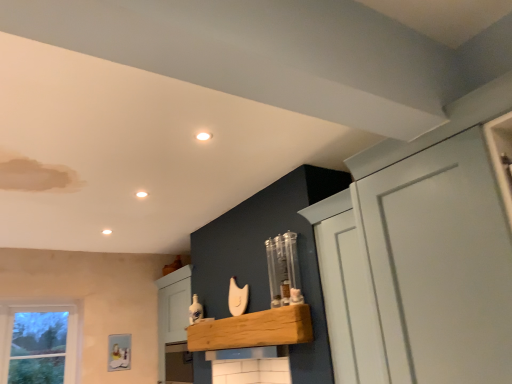
Where is `white matte cupboard at upper right`? The height and width of the screenshot is (384, 512). white matte cupboard at upper right is located at coordinates (419, 270).

What do you see at coordinates (419, 270) in the screenshot? I see `white matte cupboard at upper right` at bounding box center [419, 270].

Find the location of a particular element. natural wood shelf at center is located at coordinates (253, 330).

This screenshot has width=512, height=384. What do you see at coordinates (253, 330) in the screenshot?
I see `natural wood shelf at center` at bounding box center [253, 330].

The image size is (512, 384). Identify the location of white matte cupboard at upper right. (419, 270).

Does natural wood shelf at center appear on the right side of white matte cupboard at upper right?

No, natural wood shelf at center is not to the right of white matte cupboard at upper right.

Between natural wood shelf at center and white matte cupboard at upper right, which one is positioned behind?

Positioned behind is natural wood shelf at center.

Considering the positions of point (210, 349) and point (361, 354), is point (210, 349) closer or farther from the camera than point (361, 354)?

Point (210, 349).

From the image's perspective, is natural wood shelf at center located beneath white matte cupboard at upper right?

Indeed, from the image's perspective, natural wood shelf at center is shown beneath white matte cupboard at upper right.

From a real-world perspective, is natural wood shelf at center positioned above or below white matte cupboard at upper right?

From a real-world perspective, natural wood shelf at center is physically below white matte cupboard at upper right.

Considering the sizes of natural wood shelf at center and white matte cupboard at upper right in the image, is natural wood shelf at center wider or thinner than white matte cupboard at upper right?

natural wood shelf at center is thinner than white matte cupboard at upper right.

Is natural wood shelf at center taller or shorter than white matte cupboard at upper right?

Clearly, natural wood shelf at center is shorter compared to white matte cupboard at upper right.

Can you confirm if natural wood shelf at center is bigger than white matte cupboard at upper right?

Incorrect, natural wood shelf at center is not larger than white matte cupboard at upper right.

Could white matte cupboard at upper right be considered to be inside natural wood shelf at center?

No, natural wood shelf at center does not contain white matte cupboard at upper right.

Is natural wood shelf at center placed right next to white matte cupboard at upper right?

They are not placed beside each other.

Is natural wood shelf at center aimed at white matte cupboard at upper right?

No, natural wood shelf at center is not oriented towards white matte cupboard at upper right.

Can you tell me how much natural wood shelf at center and white matte cupboard at upper right differ in facing direction?

The angle between the facing direction of natural wood shelf at center and the facing direction of white matte cupboard at upper right is 1.42 degrees.

Measure the distance between natural wood shelf at center and white matte cupboard at upper right.

They are 39.09 inches apart.

You are a GUI agent. You are given a task and a screenshot of the screen. Output one action in this format:
    pyautogui.click(x=<x>, y=<y>)
    Task: Click on the cupboard lying in front of the natural wood shelf at center
    
    Given the screenshot: What is the action you would take?
    pyautogui.click(x=419, y=270)

Does white matte cupboard at upper right appear on the right side of natural wood shelf at center?

Yes, white matte cupboard at upper right is to the right of natural wood shelf at center.

In the image, is white matte cupboard at upper right positioned in front of or behind natural wood shelf at center?

white matte cupboard at upper right is positioned closer to the viewer than natural wood shelf at center.

Is point (485, 378) positioned before point (211, 331)?

Yes, point (485, 378) is in front of point (211, 331).

Consider the image. From the image's perspective, is white matte cupboard at upper right on top of natural wood shelf at center?

Indeed, from the image's perspective, white matte cupboard at upper right is shown above natural wood shelf at center.

From a real-world perspective, between white matte cupboard at upper right and natural wood shelf at center, who is vertically higher?

white matte cupboard at upper right, from a real-world perspective.

Looking at their sizes, would you say white matte cupboard at upper right is wider or thinner than natural wood shelf at center?

In the image, white matte cupboard at upper right appears to be wider than natural wood shelf at center.

Which of these two, white matte cupboard at upper right or natural wood shelf at center, stands shorter?

natural wood shelf at center is shorter.

Who is bigger, white matte cupboard at upper right or natural wood shelf at center?

white matte cupboard at upper right.

Is white matte cupboard at upper right positioned beyond the bounds of natural wood shelf at center?

Indeed, white matte cupboard at upper right is completely outside natural wood shelf at center.

Are white matte cupboard at upper right and natural wood shelf at center located far from each other?

No, there isn't a large distance between white matte cupboard at upper right and natural wood shelf at center.

Looking at this image, is natural wood shelf at center at the back of white matte cupboard at upper right?

No, white matte cupboard at upper right is not facing away from natural wood shelf at center.

Can you tell me how much white matte cupboard at upper right and natural wood shelf at center differ in facing direction?

The angular difference between white matte cupboard at upper right and natural wood shelf at center is 1.42 degrees.

You are a GUI agent. You are given a task and a screenshot of the screen. Output one action in this format:
    pyautogui.click(x=<x>, y=<y>)
    Task: Click on the cupboard on the right of natural wood shelf at center
    This screenshot has height=384, width=512.
    Given the screenshot: What is the action you would take?
    pyautogui.click(x=419, y=270)

In order to click on cabinetry behind the white matte cupboard at upper right in this screenshot , I will do `click(253, 330)`.

In order to click on cabinetry on the left of white matte cupboard at upper right in this screenshot , I will do `click(253, 330)`.